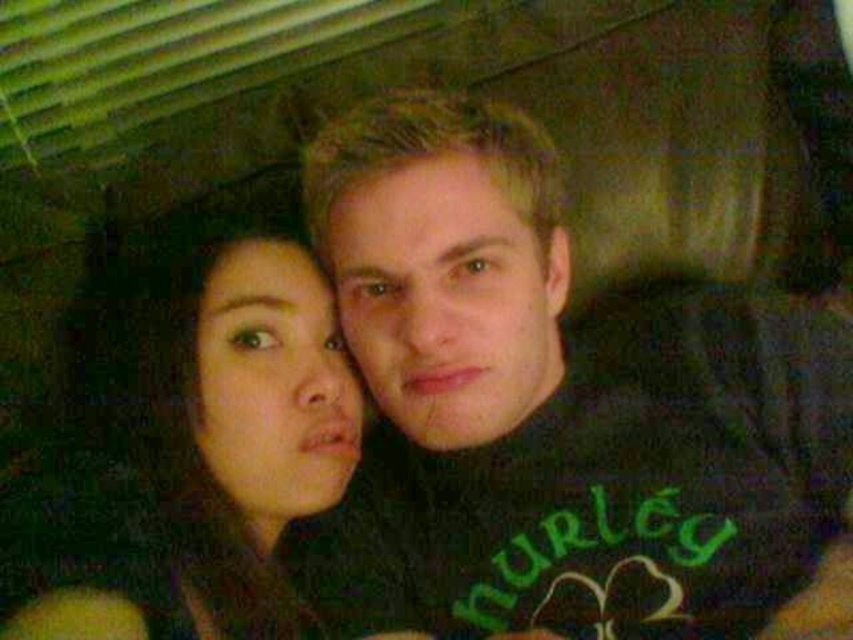
Can you confirm if matte black shirt at center is positioned to the left of smooth skin face at center?

Incorrect, matte black shirt at center is not on the left side of smooth skin face at center.

Who is more forward, (370, 192) or (323, 342)?

Positioned in front is point (370, 192).

Measure the distance between matte black shirt at center and camera.

The distance of matte black shirt at center from camera is 27.60 inches.

Locate an element on the screen. matte black shirt at center is located at coordinates (572, 388).